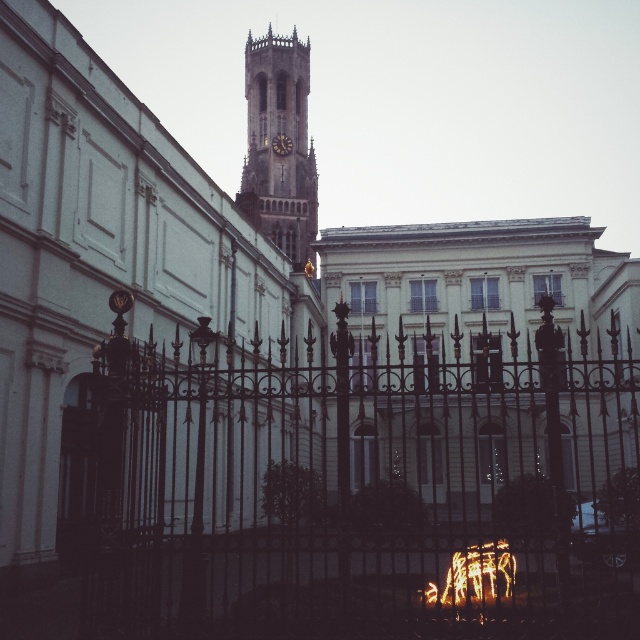
You are a visitor standing in front of the black wrought iron gate at center and the brown stone clock tower at center. Which structure is taller?

The brown stone clock tower at center is taller than the black wrought iron gate at center.

You are standing in front of the large wrought iron gate and see both the brown stone clock tower at center and the dark brown wooden clock at center. Which clock is located to the right of the other?

The brown stone clock tower at center is positioned on the right side of the dark brown wooden clock at center, so it is to the right of the wooden clock.

Looking at this image, you are standing at the entrance of the large wrought iron gate. You want to walk directly towards the brown stone clock tower at center. How far will you have to walk to reach it from the dark brown wooden clock at center?

The brown stone clock tower at center is 17.32 meters away from the dark brown wooden clock at center. Therefore, you would need to walk approximately 17.32 meters to reach the brown stone clock tower at center from the dark brown wooden clock at center.